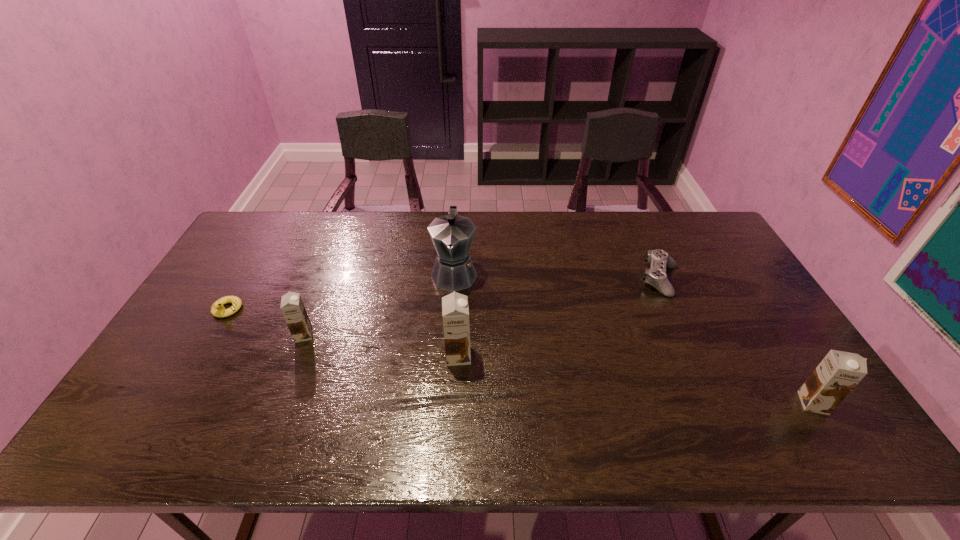
At what (x,y) coordinates should I click in order to perform the action: click on free region located on the right of the farthest chocolate milk. Please return your answer as a coordinate pair (x, y). Looking at the image, I should click on [349, 335].

Find the location of a particular element. blank space located 0.280m on the back of the second nearest object is located at coordinates (462, 278).

Locate an element on the screen. The height and width of the screenshot is (540, 960). free region located 0.230m on the back of the second tallest chocolate milk is located at coordinates (762, 322).

Locate an element on the screen. free space located at the spout of the coffeepot is located at coordinates (449, 353).

Where is `vacant space located on the front of the control`? This screenshot has width=960, height=540. vacant space located on the front of the control is located at coordinates (711, 395).

Find the location of a particular element. The image size is (960, 540). vacant space situated 0.100m on the face of the third farthest object is located at coordinates (204, 349).

The image size is (960, 540). I want to click on object that is at the near edge, so click(839, 372).

Find the location of a particular element. object present at the left edge is located at coordinates [x=217, y=309].

Identify the location of object that is positioned at the right edge. (839, 372).

Find the location of `object that is at the near right corner`. object that is at the near right corner is located at coordinates (839, 372).